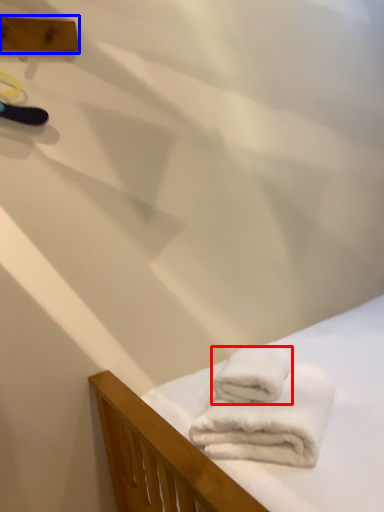
Question: Which of the following is the closest to the observer, towel (highlighted by a red box) or plank (highlighted by a blue box)?

Choices:
 (A) towel
 (B) plank

Answer: (A)